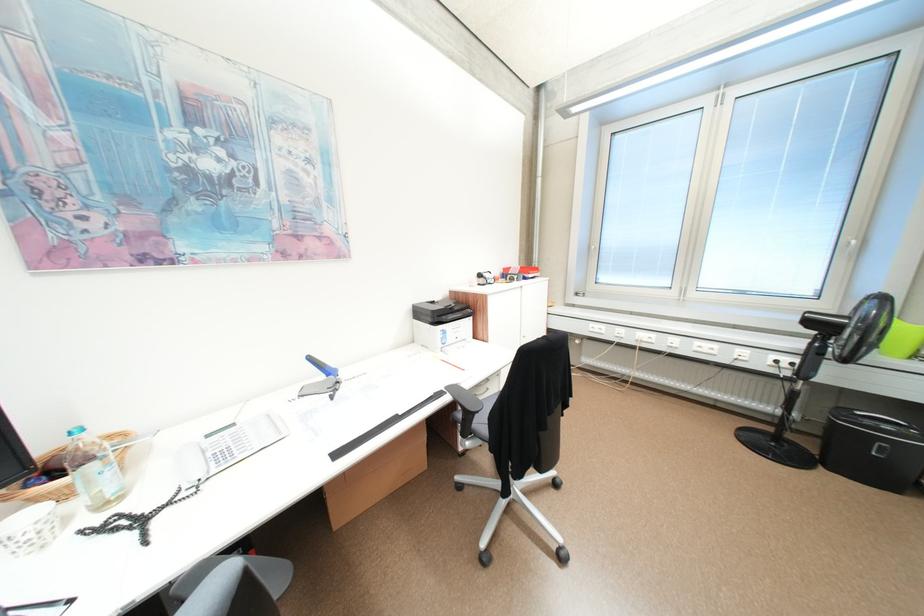
This screenshot has height=616, width=924. What are the coordinates of `wicker basket` in the screenshot? It's located at (62, 475).